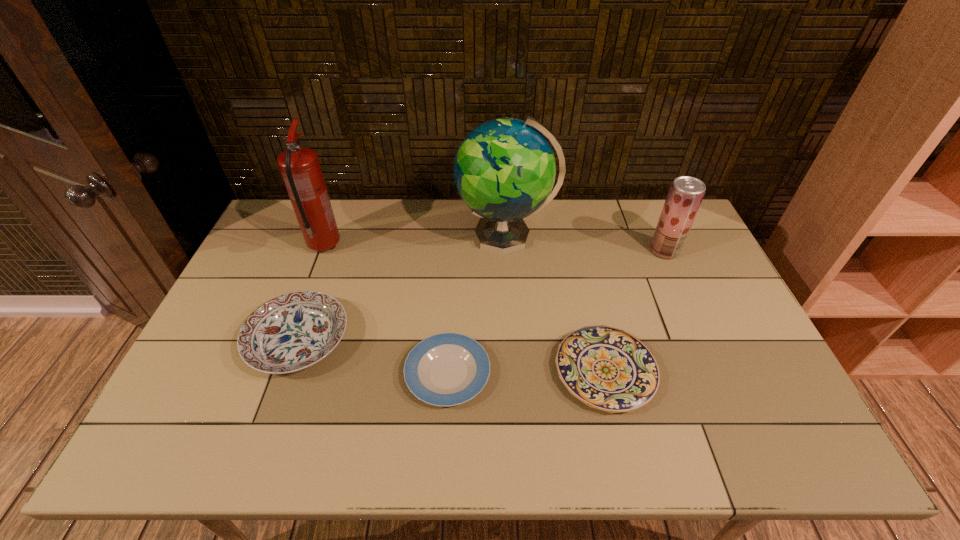
Find the location of a particular element. free space that satisfies the following two spatial constraints: 1. on the back side of the rightmost object; 2. on the left side of the rightmost plate is located at coordinates (577, 251).

At what (x,y) coordinates should I click in order to perform the action: click on vacant position in the image that satisfies the following two spatial constraints: 1. on the front surface of the rightmost plate; 2. on the left side of the globe. Please return your answer as a coordinate pair (x, y). Looking at the image, I should click on (515, 372).

This screenshot has width=960, height=540. Identify the location of free point that satisfies the following two spatial constraints: 1. on the front side of the rightmost plate; 2. on the left side of the tallest plate. (287, 372).